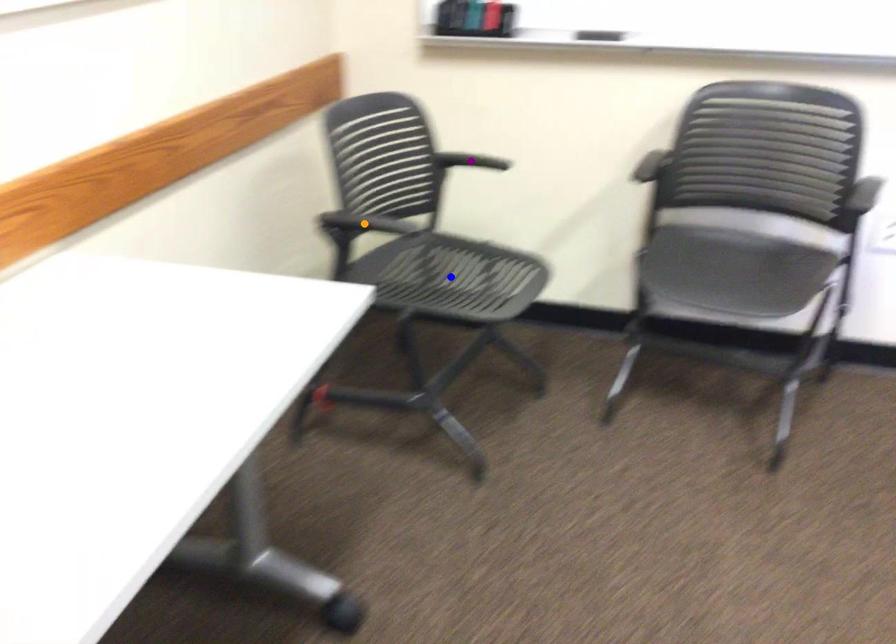
Order these from nearest to farthest:
- orange point
- blue point
- purple point

orange point, blue point, purple point